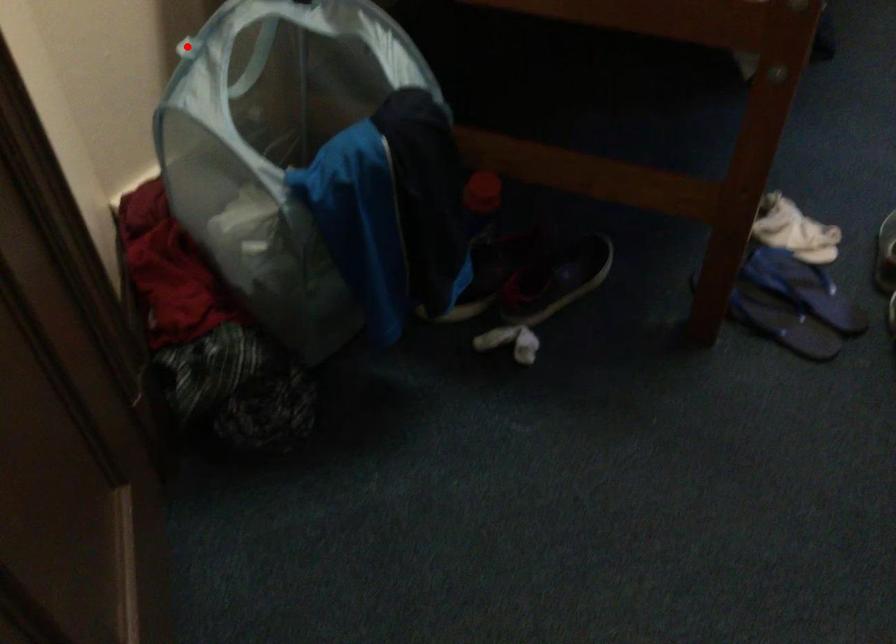
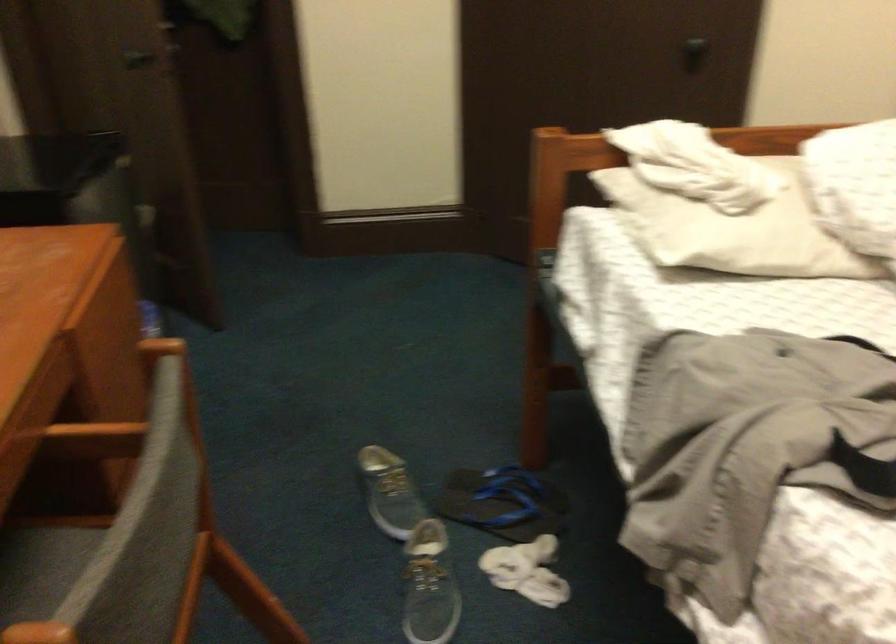
Question: I am providing you with two images of the same scene from different viewpoints. A red point is marked on the first image. Is the red point's position out of view in image 2?

Choices:
 (A) Yes
 (B) No

Answer: (A)